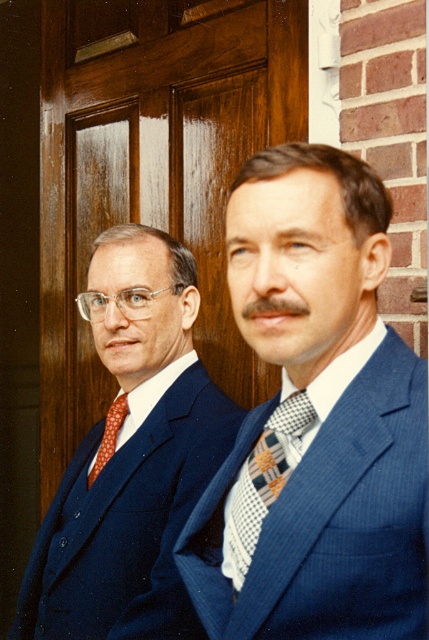
The height and width of the screenshot is (640, 429). Find the location of `blue textured suit at center`. blue textured suit at center is located at coordinates (316, 417).

Does blue textured suit at center have a smaller size compared to wooden at center?

Yes.

Is point (262, 493) closer to camera compared to point (271, 138)?

Yes, point (262, 493) is closer to viewer.

In order to click on blue textured suit at center in this screenshot , I will do [316, 417].

Between matte blue suit at left and checkered fabric tie at center, which one has more height?

matte blue suit at left is taller.

Which is more to the left, matte blue suit at left or checkered fabric tie at center?

matte blue suit at left

The height and width of the screenshot is (640, 429). In order to click on matte blue suit at left in this screenshot , I will do `click(132, 456)`.

Measure the distance between checkered fabric tie at center and camera.

28.56 inches

Can you confirm if checkered fabric tie at center is positioned to the left of polka dot silk tie at left?

In fact, checkered fabric tie at center is to the right of polka dot silk tie at left.

Between point (274, 429) and point (114, 428), which one is positioned behind?

The point (114, 428) is more distant.

The image size is (429, 640). Identify the location of checkered fabric tie at center. (262, 481).